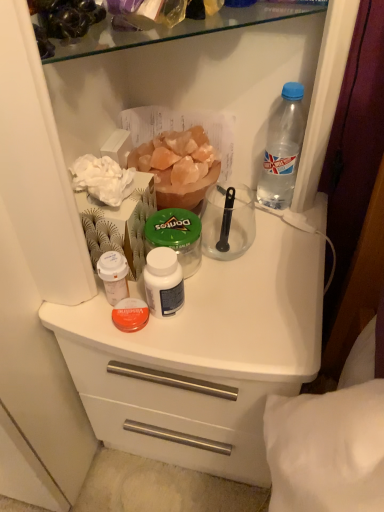
Question: In the image, is white matte plastic counter at center on the left side or the right side of orange crystal salt at center?

Choices:
 (A) right
 (B) left

Answer: (A)

Question: Does point (198, 385) appear closer or farther from the camera than point (198, 150)?

Choices:
 (A) closer
 (B) farther

Answer: (A)

Question: Which object is positioned farthest from the green plastic jar at center?

Choices:
 (A) orange crystal salt at center
 (B) white matte plastic cup at upper left, which is counted as the first bottle, starting from the bottom
 (C) transparent plastic spoon at center
 (D) white matte plastic counter at center
 (E) white matte jar at center

Answer: (D)

Question: Considering the real-world distances, which object is farthest from the orange crystal salt at center?

Choices:
 (A) white matte plastic counter at center
 (B) white matte jar at center
 (C) transparent plastic spoon at center
 (D) white matte plastic cup at upper left, positioned as the 1th bottle in left-to-right order
 (E) transparent plastic bottle at upper right, arranged as the 1th bottle when viewed from the top

Answer: (A)